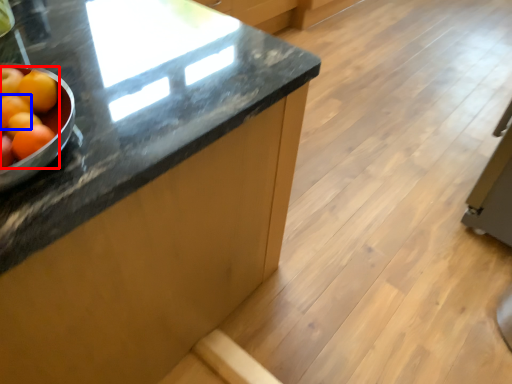
Question: Among these objects, which one is farthest to the camera, grapefruit (highlighted by a red box) or orange (highlighted by a blue box)?

Choices:
 (A) grapefruit
 (B) orange

Answer: (B)